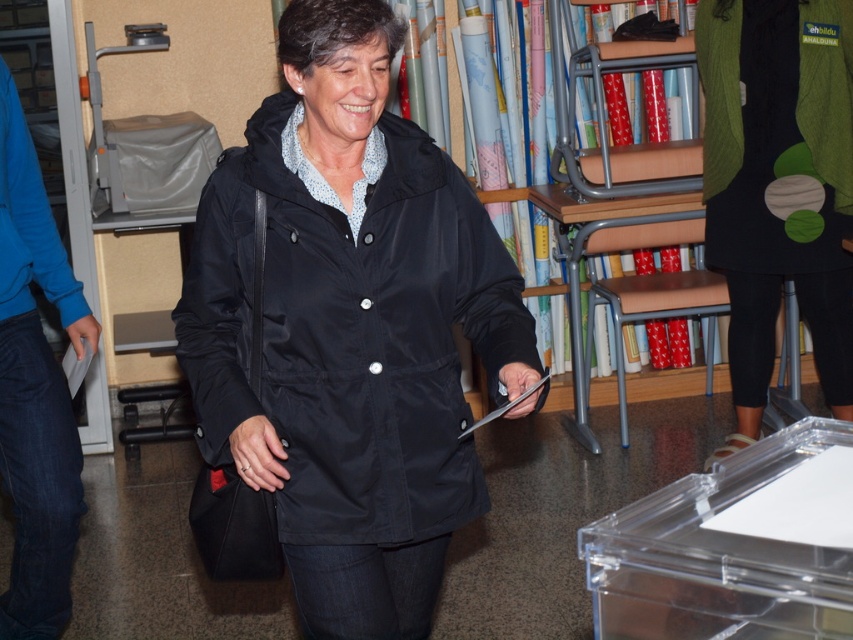
Can you confirm if matte black jacket at center is taller than green textured dress at right?

No, matte black jacket at center is not taller than green textured dress at right.

Who is shorter, matte black jacket at center or green textured dress at right?

matte black jacket at center is shorter.

Is point (407, 525) closer to camera compared to point (732, 317)?

That is True.

What are the coordinates of `matte black jacket at center` in the screenshot? It's located at (350, 333).